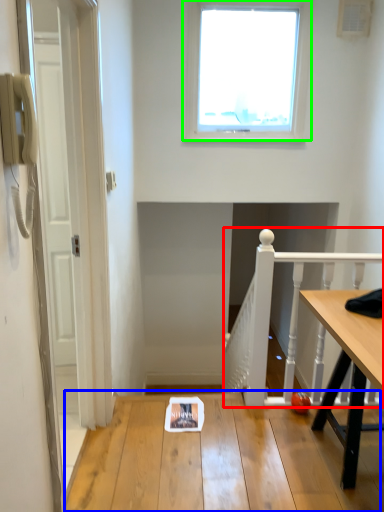
Question: Which is farther away from rail (highlighted by a red box)? table (highlighted by a blue box) or window (highlighted by a green box)?

Choices:
 (A) table
 (B) window

Answer: (B)